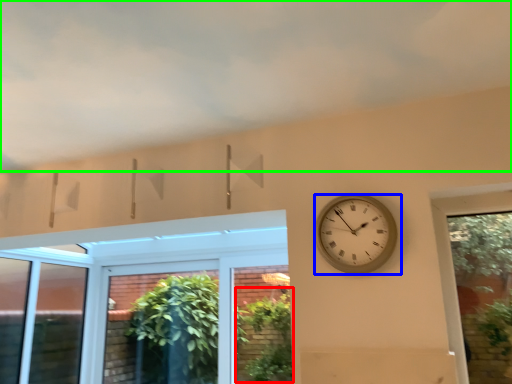
Question: Estimate the real-world distances between objects in this image. Which object is closer to plant (highlighted by a red box), wall clock (highlighted by a blue box) or cloud (highlighted by a green box)?

Choices:
 (A) wall clock
 (B) cloud

Answer: (A)